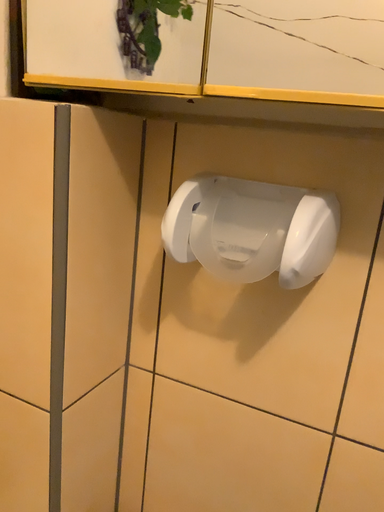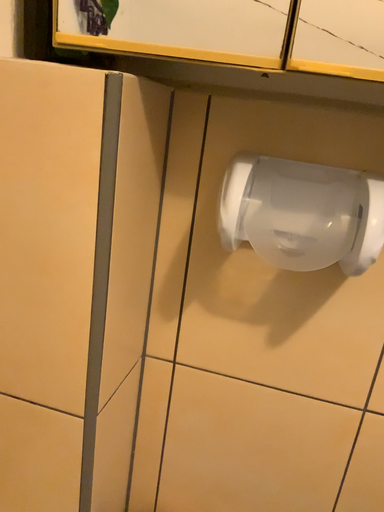
Question: Which way did the camera rotate in the video?

Choices:
 (A) rotated right
 (B) rotated left

Answer: (A)